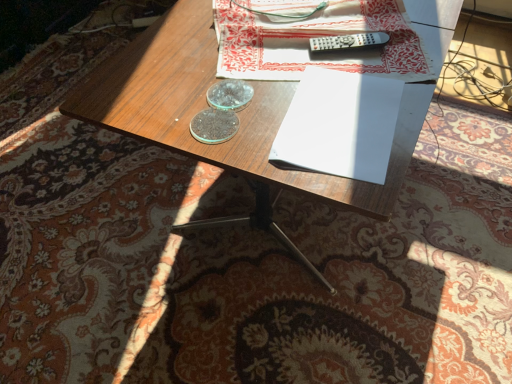
Where is `spots to the right of black plastic remote at upper center`? spots to the right of black plastic remote at upper center is located at coordinates (407, 44).